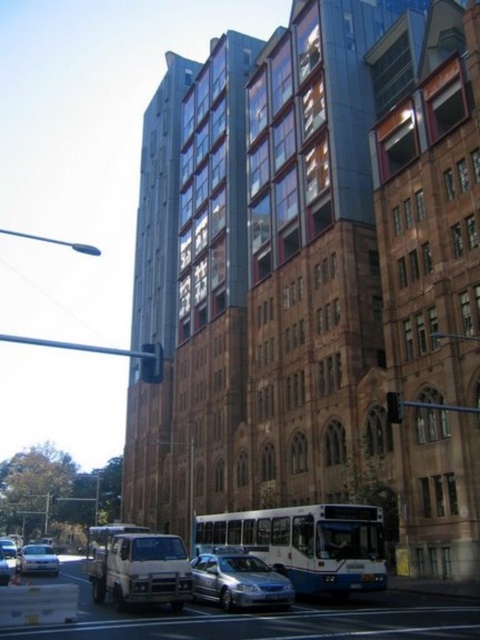
Between point (99, 536) and point (144, 371), which one is positioned in front?

Point (144, 371) is more forward.

Measure the distance between point [92,541] and camera.

Point [92,541] and camera are 48.06 meters apart from each other.

At what (x,y) coordinates should I click in order to perform the action: click on matte white bus at center. Please return your answer as a coordinate pair (x, y). Image resolution: width=480 pixels, height=640 pixels. Looking at the image, I should click on (137, 566).

Does black plastic traffic light at center have a smaller size compared to silver metallic sedan at center?

No.

Which is behind, point (142, 374) or point (4, 566)?

The point (4, 566) is more distant.

Where is `black plastic traffic light at center`? This screenshot has height=640, width=480. black plastic traffic light at center is located at coordinates (151, 362).

Does silver metallic sedan at lower left appear on the right side of silver metallic sedan at center?

No, silver metallic sedan at lower left is not to the right of silver metallic sedan at center.

Does point (46, 572) lie behind point (4, 564)?

Yes, it is behind point (4, 564).

Between point (24, 566) and point (1, 557), which one is positioned in front?

Point (1, 557) is more forward.

What are the coordinates of `silver metallic sedan at lower left` in the screenshot? It's located at (36, 560).